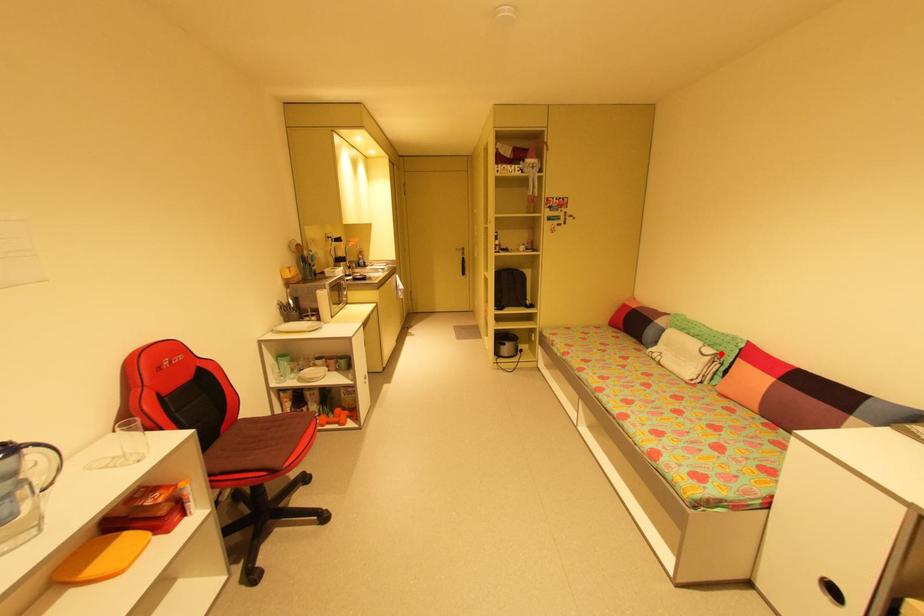
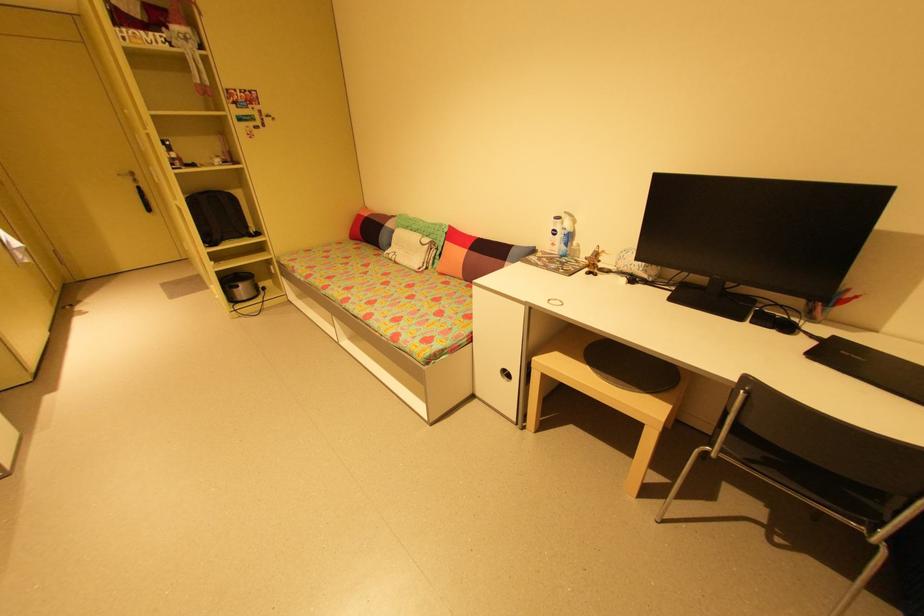
Question: I am providing you with two images of the same scene from different viewpoints. Given a red point in image1, look at the same physical point in image2. Is it:

Choices:
 (A) Closer to the viewpoint
 (B) Farther from the viewpoint

Answer: (A)